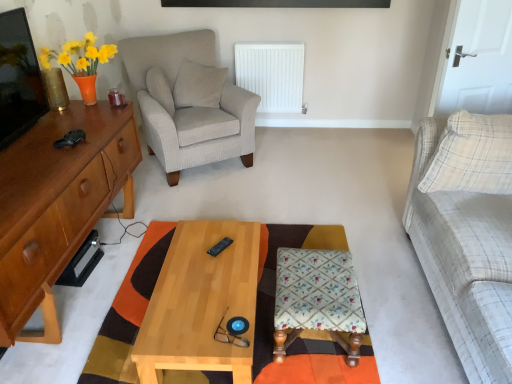
I want to click on vacant area that lies between plaid fabric couch at right and light gray textured armchair at center, so click(x=312, y=210).